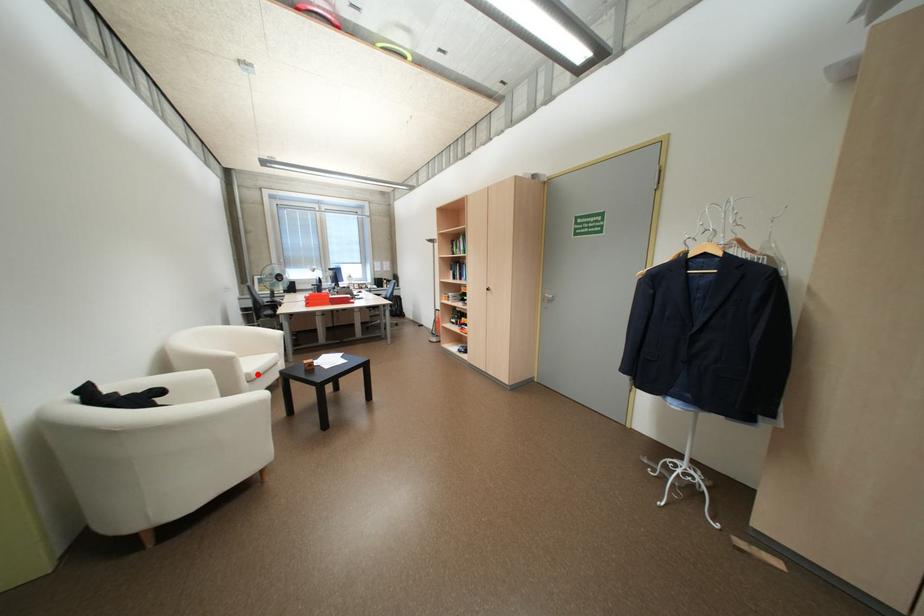
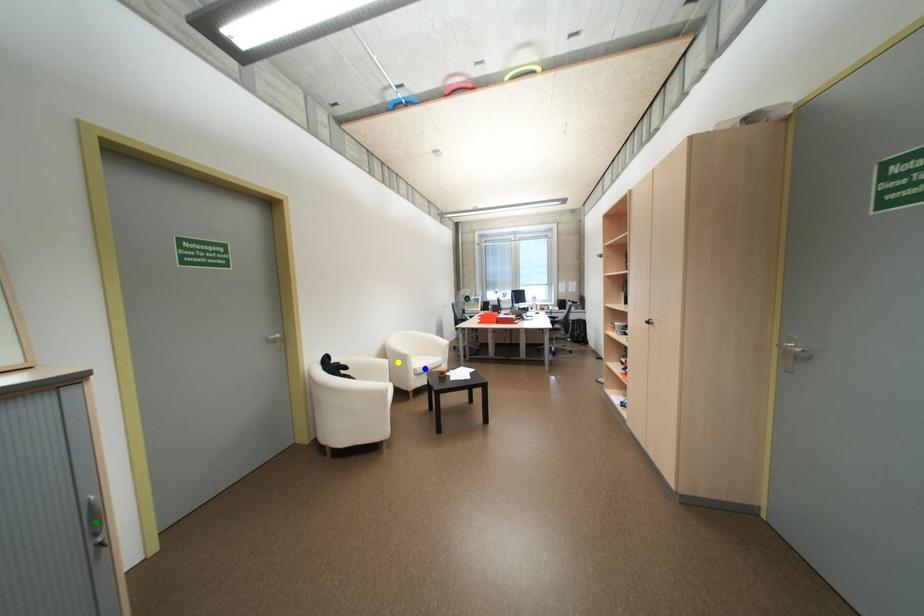
Question: I am providing you with two images of the same scene from different viewpoints. A red point is marked on the first image. You are given multiple points on the second image. Which spot in image 2 lines up with the point in image 1?

Choices:
 (A) green point
 (B) blue point
 (C) yellow point

Answer: (B)